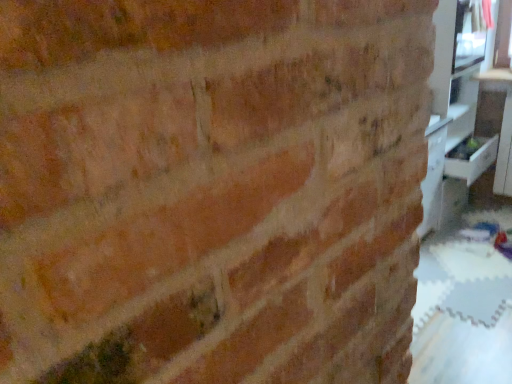
Question: Is white glossy entertainment center at right inside or outside of white glossy drawer at right?

Choices:
 (A) inside
 (B) outside

Answer: (B)

Question: From the image's perspective, relative to white glossy drawer at right, is white glossy entertainment center at right above or below?

Choices:
 (A) above
 (B) below

Answer: (A)

Question: Is white glossy entertainment center at right bigger or smaller than white glossy drawer at right?

Choices:
 (A) big
 (B) small

Answer: (A)

Question: Is point (444, 170) positioned closer to the camera than point (432, 152)?

Choices:
 (A) closer
 (B) farther

Answer: (B)

Question: Considering their positions, is white glossy drawer at right located in front of or behind white glossy entertainment center at right?

Choices:
 (A) behind
 (B) front

Answer: (A)

Question: In terms of height, does white glossy drawer at right look taller or shorter compared to white glossy entertainment center at right?

Choices:
 (A) tall
 (B) short

Answer: (B)

Question: Based on their positions, is white glossy drawer at right located to the left or right of white glossy entertainment center at right?

Choices:
 (A) left
 (B) right

Answer: (B)